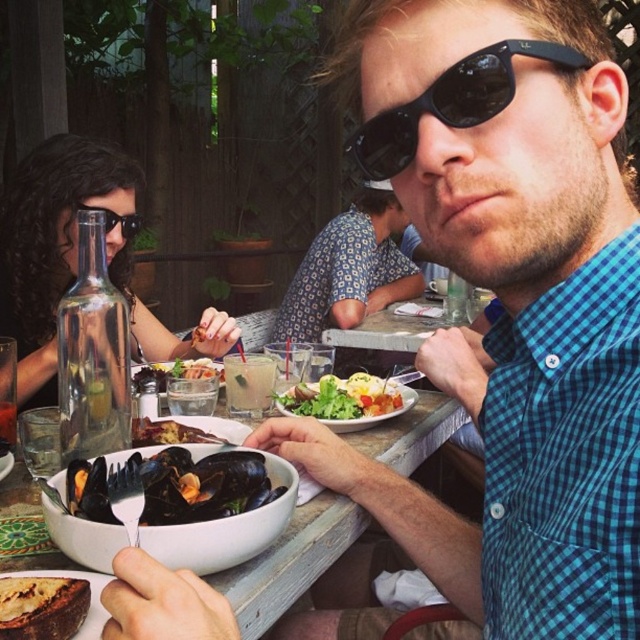
Question: Can you confirm if shiny dark shellfish at center is wider than black plastic sunglasses at upper center?

Choices:
 (A) yes
 (B) no

Answer: (A)

Question: Based on their relative distances, which object is farther from the brown toasted bread at lower left?

Choices:
 (A) white ceramic bowl at center
 (B) shiny black mussels at center

Answer: (A)

Question: Which point is closer to the camera taking this photo?

Choices:
 (A) (397, 404)
 (B) (44, 602)
 (C) (0, 449)
 (D) (362, 289)

Answer: (B)

Question: Observing the image, what is the correct spatial positioning of floral-patterned shirt at center in reference to matte black goggles at upper left?

Choices:
 (A) above
 (B) below

Answer: (B)

Question: In this image, where is white ceramic bowl at center located relative to black plastic sunglasses at upper center?

Choices:
 (A) below
 (B) above

Answer: (A)

Question: Among these points, which one is nearest to the camera?

Choices:
 (A) (304, 577)
 (B) (332, 410)
 (C) (3, 456)
 (D) (141, 426)

Answer: (A)